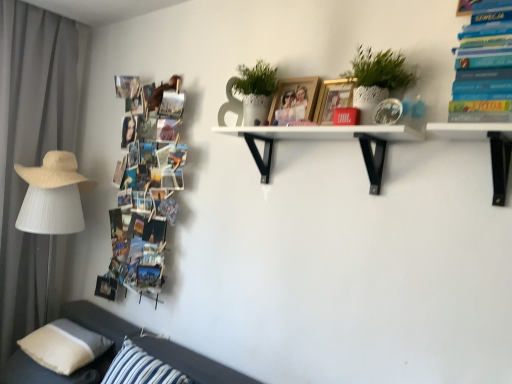
Identify the location of free space above white matte shelf at center (from a real-world perspective). The image size is (512, 384). (319, 131).